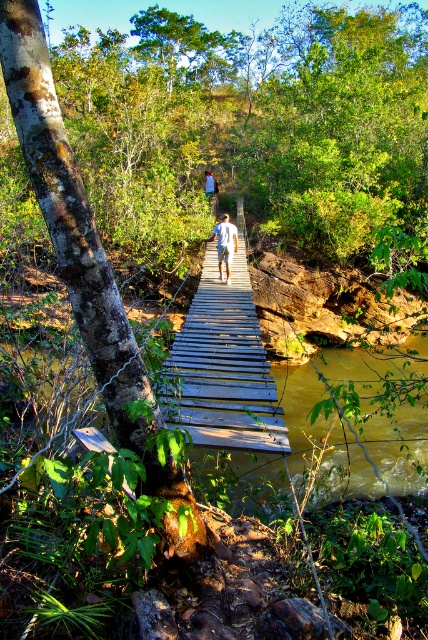
You are standing on the riverbank and want to cross the river using the wooden bridge at center. If your backpack is 1.8 meters long, will it fit on the bridge? Please explain.

The wooden bridge at center is 5.09 meters from viewer. Since the backpack is 1.8 meters long, it will fit on the bridge as the bridge is longer than the backpack.

Looking at this image, you are standing on the rustic wooden bridge and notice a white cotton shirt at center and brown muddy water at center. Which object is nearer to you?

The brown muddy water at center is closer to the viewer than the white cotton shirt at center.